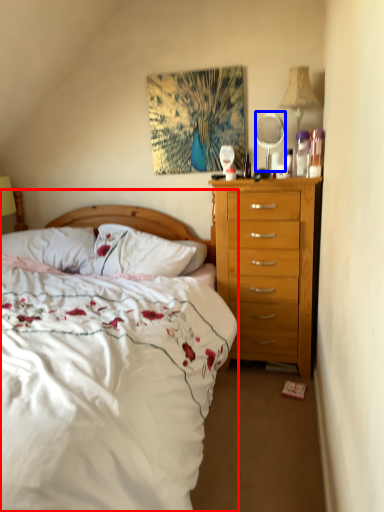
Question: Among these objects, which one is nearest to the camera, bed (highlighted by a red box) or mirror (highlighted by a blue box)?

Choices:
 (A) bed
 (B) mirror

Answer: (A)